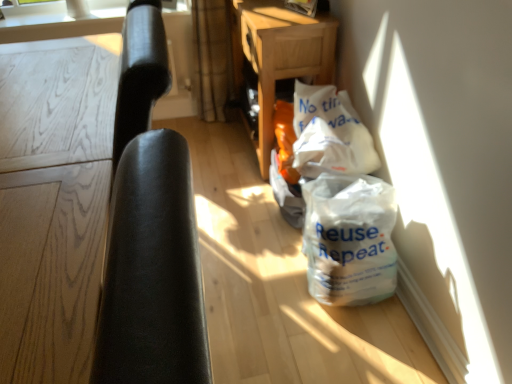
Question: Would you say white matte plastic bag at lower right is to the left or to the right of black leather chair at left in the picture?

Choices:
 (A) left
 (B) right

Answer: (B)

Question: Considering the positions of white matte plastic bag at lower right and black leather chair at left in the image, is white matte plastic bag at lower right taller or shorter than black leather chair at left?

Choices:
 (A) tall
 (B) short

Answer: (B)

Question: Estimate the real-world distances between objects in this image. Which object is farther from the white paper bag at center?

Choices:
 (A) black leather chair at left
 (B) wooden at center
 (C) white matte plastic bag at lower right

Answer: (A)

Question: Based on their relative distances, which object is farther from the wooden at center?

Choices:
 (A) white matte plastic bag at lower right
 (B) white paper bag at center
 (C) black leather chair at left

Answer: (C)